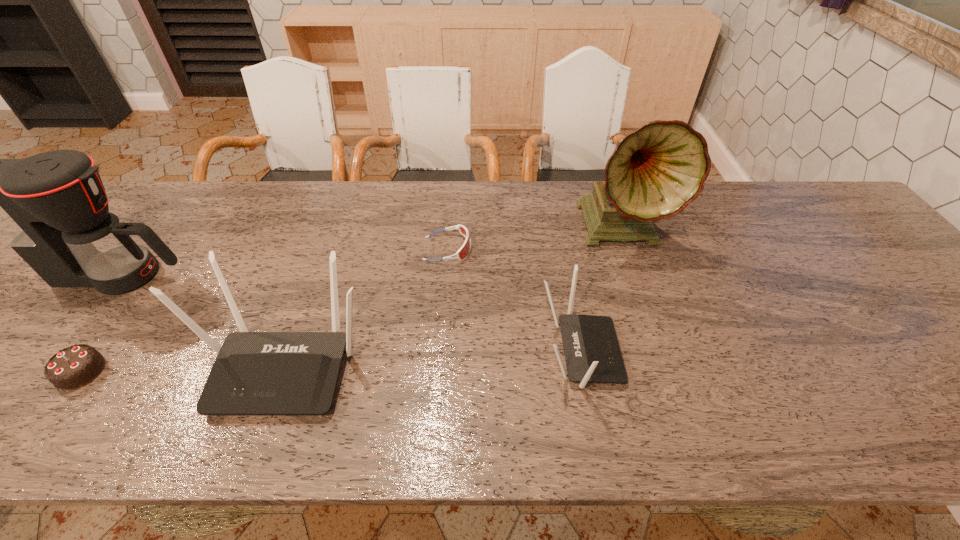
In order to click on vacant space at the far right corner of the desktop in this screenshot , I will do `click(824, 213)`.

I want to click on free space between the shorter router and the fourth shortest object, so click(x=432, y=358).

Image resolution: width=960 pixels, height=540 pixels. What are the coordinates of `free space between the shortest object and the fourth tallest object` in the screenshot? It's located at (514, 300).

Where is `free point between the third tallest object and the coffee maker`? The width and height of the screenshot is (960, 540). free point between the third tallest object and the coffee maker is located at coordinates (204, 320).

Find the location of a particular element. vacant area between the chocolate cake and the left router is located at coordinates (183, 368).

Find the location of a particular element. The height and width of the screenshot is (540, 960). empty location between the goggles and the fourth object from right to left is located at coordinates (367, 306).

The width and height of the screenshot is (960, 540). Find the location of `free spot between the third object from right to left and the chocolate cake`. free spot between the third object from right to left and the chocolate cake is located at coordinates (264, 310).

Locate an element on the screen. The width and height of the screenshot is (960, 540). empty location between the third object from right to left and the record player is located at coordinates (535, 239).

Identify which object is the closest to the shortest object. Please provide its 2D coordinates. Your answer should be formatted as a tuple, i.e. [(x, y)], where the tuple contains the x and y coordinates of a point satisfying the conditions above.

[(255, 373)]

Where is `object that stands as the fifth closest to the record player`? Image resolution: width=960 pixels, height=540 pixels. object that stands as the fifth closest to the record player is located at coordinates (73, 367).